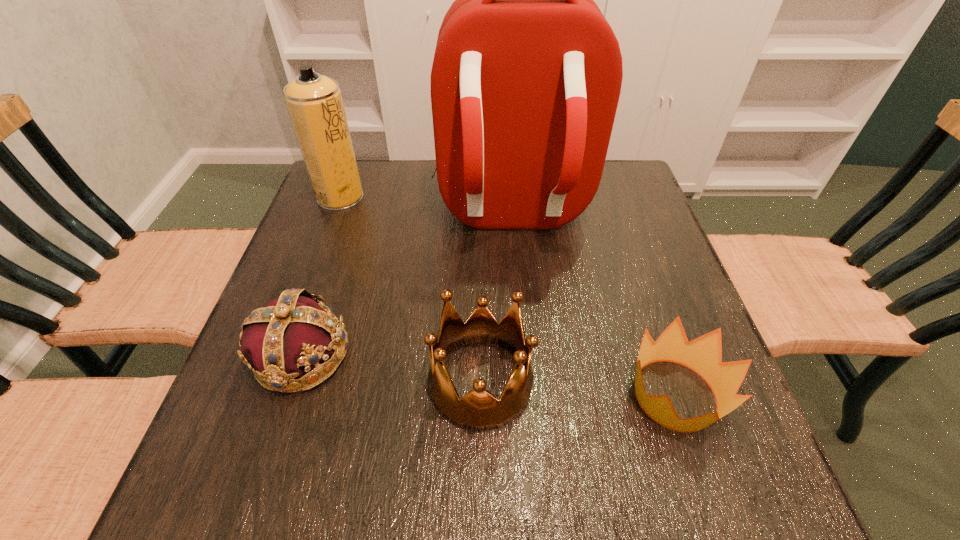
Locate an element on the screen. free space between the aerosol can and the third tallest object is located at coordinates (411, 289).

You are a GUI agent. You are given a task and a screenshot of the screen. Output one action in this format:
    pyautogui.click(x=<x>, y=<y>)
    Task: Click on the vacant space in between the shortest object and the fourth shortest object
    
    Given the screenshot: What is the action you would take?
    pyautogui.click(x=508, y=296)

The width and height of the screenshot is (960, 540). In order to click on vacant space that is in between the tallest object and the second crown from left to right in this screenshot , I will do `click(495, 298)`.

Locate an element on the screen. vacant area between the backpack and the shortest object is located at coordinates (592, 305).

Locate an element on the screen. object identified as the closest to the fourth shortest object is located at coordinates (526, 78).

Locate which object is the closest to the second tallest object. Please provide its 2D coordinates. Your answer should be formatted as a tuple, i.e. [(x, y)], where the tuple contains the x and y coordinates of a point satisfying the conditions above.

[(526, 78)]

Locate which crown is the second closest to the second tallest object. Please provide its 2D coordinates. Your answer should be formatted as a tuple, i.e. [(x, y)], where the tuple contains the x and y coordinates of a point satisfying the conditions above.

[(478, 410)]

The image size is (960, 540). What are the coordinates of `crown that stands as the closest to the second tallest crown` in the screenshot? It's located at (478, 410).

This screenshot has height=540, width=960. I want to click on free space that satisfies the following two spatial constraints: 1. on the front side of the aerosol can; 2. on the right side of the tallest crown, so click(x=272, y=382).

The image size is (960, 540). What are the coordinates of `free space that satisfies the following two spatial constraints: 1. on the strap side of the tallest object; 2. on the left side of the rightmost crown` in the screenshot? It's located at (524, 395).